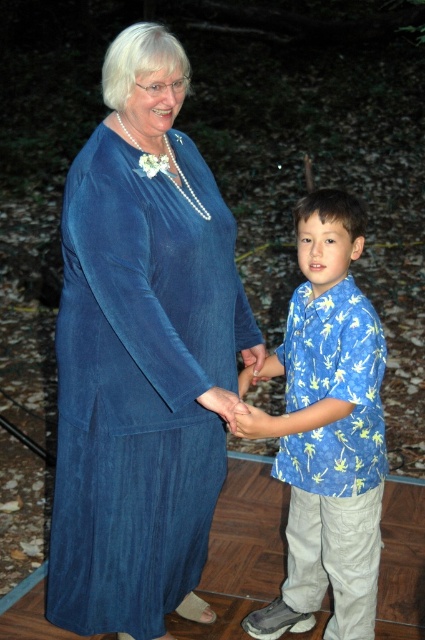
Question: Which of the following is the farthest from the observer?

Choices:
 (A) blue printed shirt at center
 (B) matte blue hand at center
 (C) velvet blue dress at center

Answer: (A)

Question: Which object is closer to the camera taking this photo?

Choices:
 (A) matte blue hand at center
 (B) blue printed shirt at center

Answer: (A)

Question: Which object appears farthest from the camera in this image?

Choices:
 (A) blue printed shirt at center
 (B) velvet blue dress at center

Answer: (A)

Question: Is velvet blue dress at center bigger than matte blue hand at center?

Choices:
 (A) yes
 (B) no

Answer: (A)

Question: Does blue printed shirt at center appear on the left side of matte blue hand at center?

Choices:
 (A) no
 (B) yes

Answer: (A)

Question: Can you confirm if velvet blue dress at center is thinner than matte blue hand at center?

Choices:
 (A) no
 (B) yes

Answer: (A)